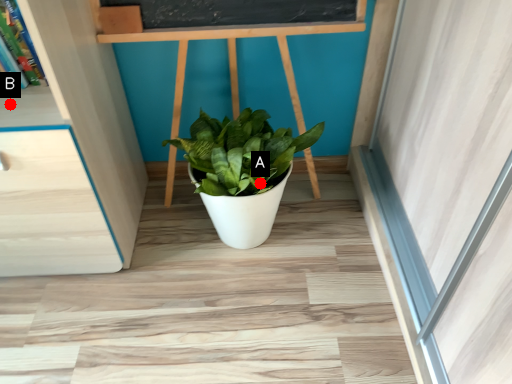
Question: Two points are circled on the image, labeled by A and B beside each circle. Which of the following is the farthest from the observer?

Choices:
 (A) A is further
 (B) B is further

Answer: (A)